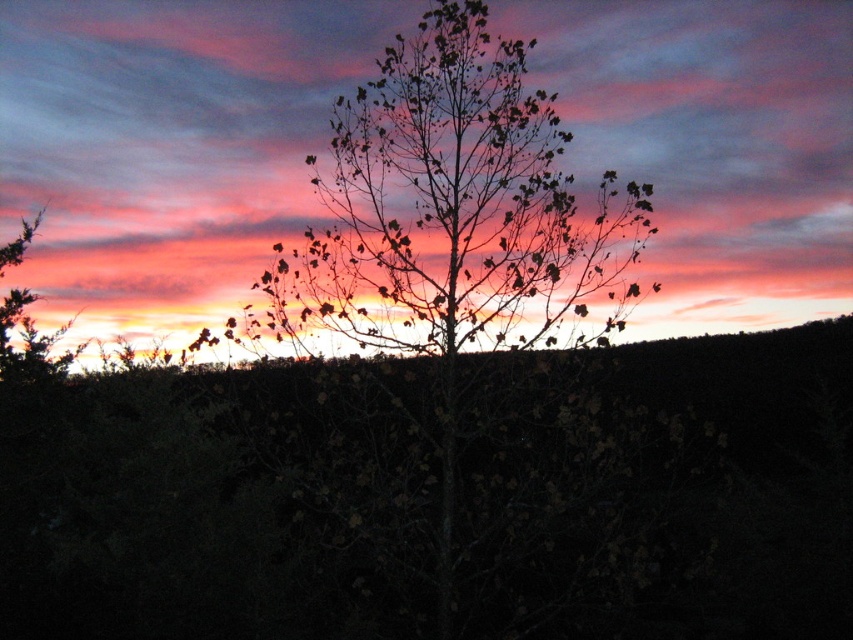
You are a bird flying at the same height as the silhouette tree at center. You want to land on the pink matte cloud at upper center. Can you reach it if your maximum flight distance is 3 meters?

The distance between the pink matte cloud at upper center and the silhouette tree at center is 3.10 meters, which exceeds your maximum flight distance of 3 meters. Therefore, you cannot reach the pink matte cloud at upper center.

You are an astronomer analyzing the sunset scene. You notice a point at coordinates point [169,145]. What object is located there?

The pink matte cloud at upper center is located at point [169,145].

You are an artist trying to paint the sunset scene. You have a limited amount of pink paint. The pink matte cloud at upper center and the silhouette tree at center both require pink paint. Which object should you use less pink paint for?

The pink matte cloud at upper center occupies less space than the silhouette tree at center, so you should use less pink paint for the pink matte cloud at upper center.